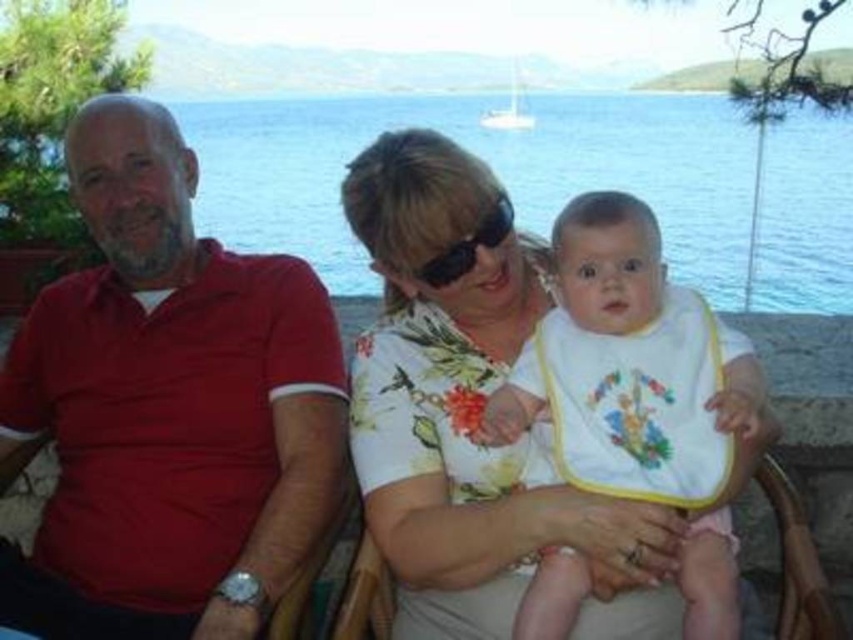
Question: Which object is closer to the camera taking this photo?

Choices:
 (A) matte red polo shirt at left
 (B) white cotton bib at center

Answer: (B)

Question: Is blue water at center thinner than white cotton bib at center?

Choices:
 (A) yes
 (B) no

Answer: (B)

Question: Which object is the closest to the white cotton bib at center?

Choices:
 (A) blue water at center
 (B) matte red polo shirt at left

Answer: (B)

Question: Can you confirm if blue water at center is bigger than white cotton bib at center?

Choices:
 (A) no
 (B) yes

Answer: (B)

Question: Which point appears closest to the camera in this image?

Choices:
 (A) (619, 323)
 (B) (515, 141)

Answer: (A)

Question: Is the position of matte red polo shirt at left less distant than that of blue water at center?

Choices:
 (A) yes
 (B) no

Answer: (A)